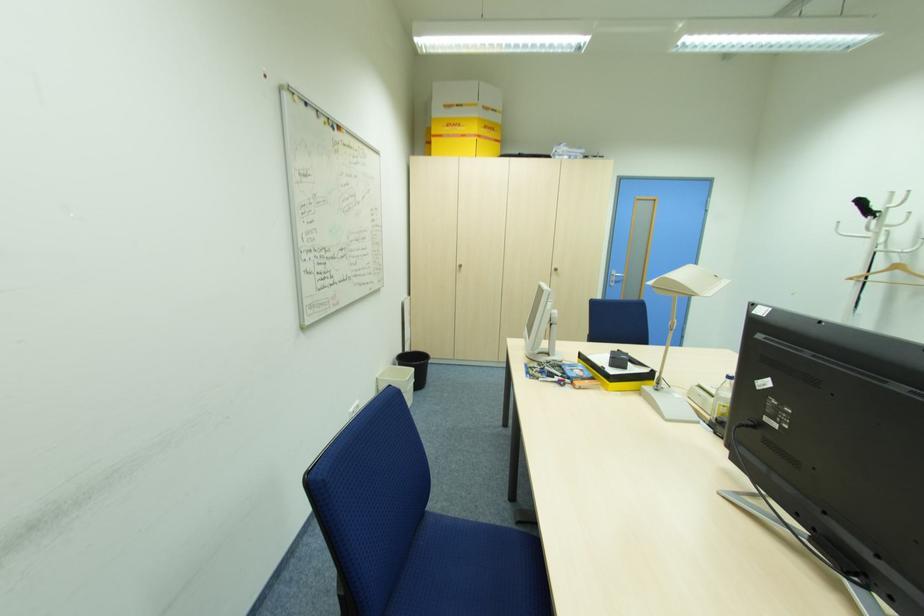
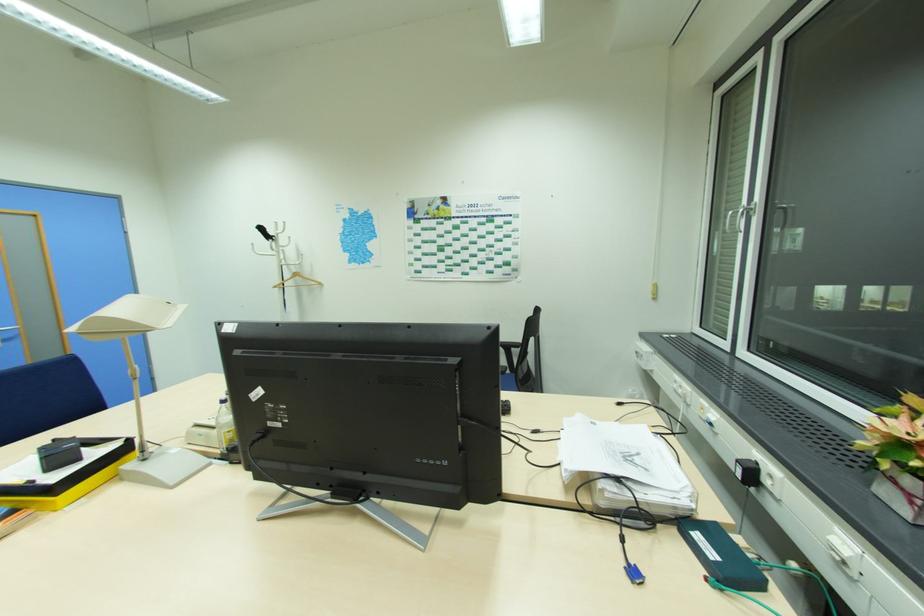
The point at (881, 212) is marked in the first image. Where is the corresponding point in the second image?

(276, 237)